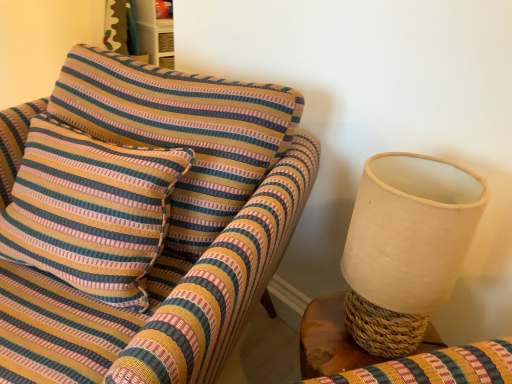
Question: Is white fabric lampshade at right inside the boundaries of woven wood table at right, or outside?

Choices:
 (A) outside
 (B) inside

Answer: (A)

Question: Looking at their shapes, would you say white fabric lampshade at right is wider or thinner than woven wood table at right?

Choices:
 (A) thin
 (B) wide

Answer: (A)

Question: Which of these objects is positioned closest to the striped fabric pillow at left?

Choices:
 (A) woven wood table at right
 (B) white fabric lampshade at right

Answer: (A)

Question: Based on their relative distances, which object is nearer to the white fabric lampshade at right?

Choices:
 (A) striped fabric pillow at left
 (B) woven wood table at right

Answer: (B)